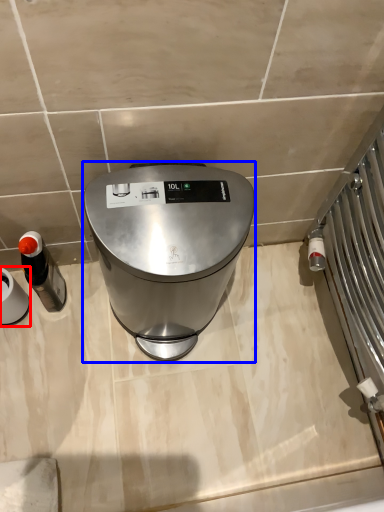
Question: Which point is further to the camera, appliance (highlighted by a red box) or home appliance (highlighted by a blue box)?

Choices:
 (A) appliance
 (B) home appliance

Answer: (A)